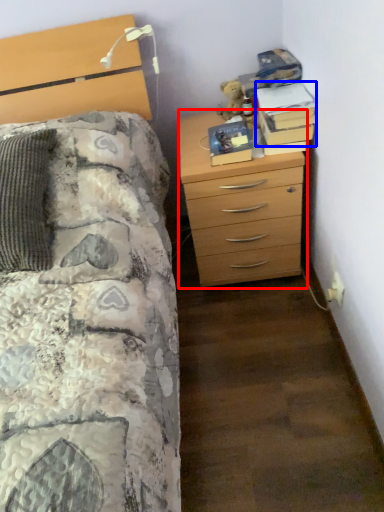
Question: Which object appears farthest to the camera in this image, chest of drawers (highlighted by a red box) or book (highlighted by a blue box)?

Choices:
 (A) chest of drawers
 (B) book

Answer: (B)